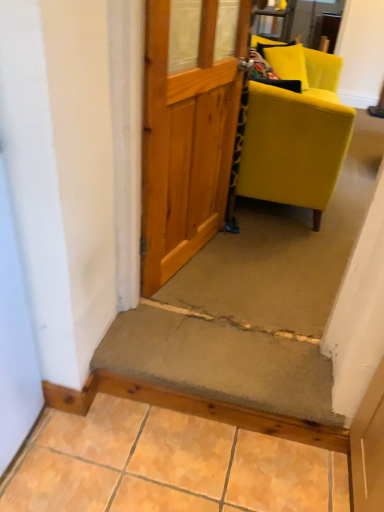
Question: Are smooth concrete step at lower center and matte yellow fabric chair at right beside each other?

Choices:
 (A) yes
 (B) no

Answer: (B)

Question: From the image's perspective, is smooth concrete step at lower center located above matte yellow fabric chair at right?

Choices:
 (A) yes
 (B) no

Answer: (B)

Question: Is the depth of smooth concrete step at lower center less than that of matte yellow fabric chair at right?

Choices:
 (A) no
 (B) yes

Answer: (B)

Question: Is smooth concrete step at lower center taller than matte yellow fabric chair at right?

Choices:
 (A) no
 (B) yes

Answer: (A)

Question: Considering the relative positions of smooth concrete step at lower center and matte yellow fabric chair at right in the image provided, is smooth concrete step at lower center behind matte yellow fabric chair at right?

Choices:
 (A) yes
 (B) no

Answer: (B)

Question: Would you say concrete textured step at center, placed as the 2th stairwell when sorted from top to bottom, is to the left or to the right of matte yellow fabric chair at right in the picture?

Choices:
 (A) right
 (B) left

Answer: (B)

Question: Looking at their shapes, would you say concrete textured step at center, placed as the 2th stairwell when sorted from top to bottom, is wider or thinner than matte yellow fabric chair at right?

Choices:
 (A) wide
 (B) thin

Answer: (B)

Question: From a real-world perspective, is concrete textured step at center, which is the first stairwell in bottom-to-top order, physically located above or below matte yellow fabric chair at right?

Choices:
 (A) below
 (B) above

Answer: (A)

Question: Considering their positions, is concrete textured step at center, which is the first stairwell in bottom-to-top order, located in front of or behind matte yellow fabric chair at right?

Choices:
 (A) front
 (B) behind

Answer: (A)

Question: Is point (347, 147) closer or farther from the camera than point (74, 486)?

Choices:
 (A) farther
 (B) closer

Answer: (A)

Question: From a real-world perspective, is matte yellow fabric chair at right positioned above or below smooth concrete step at lower center?

Choices:
 (A) below
 (B) above

Answer: (B)

Question: Is matte yellow fabric chair at right to the left or to the right of smooth concrete step at lower center in the image?

Choices:
 (A) left
 (B) right

Answer: (B)

Question: Considering the positions of matte yellow fabric chair at right and smooth concrete step at lower center in the image, is matte yellow fabric chair at right wider or thinner than smooth concrete step at lower center?

Choices:
 (A) thin
 (B) wide

Answer: (B)

Question: Considering the positions of concrete textured step at center, the first stairwell positioned from the front, and carpeted stairwell at center, the second stairwell when ordered from bottom to top, in the image, is concrete textured step at center, the first stairwell positioned from the front, wider or thinner than carpeted stairwell at center, the second stairwell when ordered from bottom to top,?

Choices:
 (A) thin
 (B) wide

Answer: (A)

Question: Is concrete textured step at center, the first stairwell positioned from the front, bigger or smaller than carpeted stairwell at center, acting as the first stairwell starting from the top?

Choices:
 (A) big
 (B) small

Answer: (B)